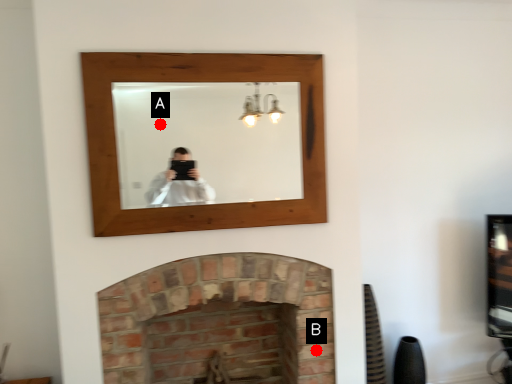
Question: Two points are circled on the image, labeled by A and B beside each circle. Which point is closer to the camera?

Choices:
 (A) A is closer
 (B) B is closer

Answer: (B)